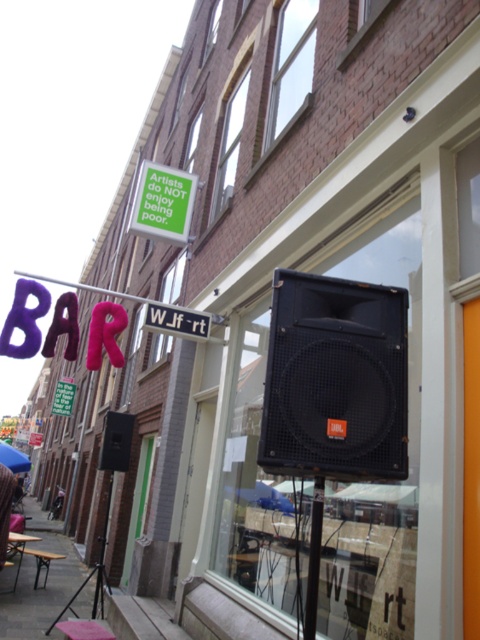
Who is taller, black mesh speaker at center or purple fabric sign at upper left?

black mesh speaker at center

How much distance is there between black mesh speaker at center and purple fabric sign at upper left?

black mesh speaker at center is 10.67 feet from purple fabric sign at upper left.

This screenshot has width=480, height=640. What do you see at coordinates (336, 380) in the screenshot?
I see `black mesh speaker at center` at bounding box center [336, 380].

The image size is (480, 640). In order to click on black mesh speaker at center in this screenshot , I will do coord(336,380).

Which of these two, purple fabric sign at upper left or black plastic pole at lower center, stands taller?

purple fabric sign at upper left

Based on the photo, between purple fabric sign at upper left and black plastic pole at lower center, which one has less height?

black plastic pole at lower center

Locate an element on the screen. purple fabric sign at upper left is located at coordinates 155,312.

You are a GUI agent. You are given a task and a screenshot of the screen. Output one action in this format:
    pyautogui.click(x=<x>, y=<y>)
    Task: Click on the green matte sign at upper left
    The width and height of the screenshot is (480, 640).
    Given the screenshot: What is the action you would take?
    163,204

Locate an element on the screen. The height and width of the screenshot is (640, 480). green matte sign at upper left is located at coordinates (163, 204).